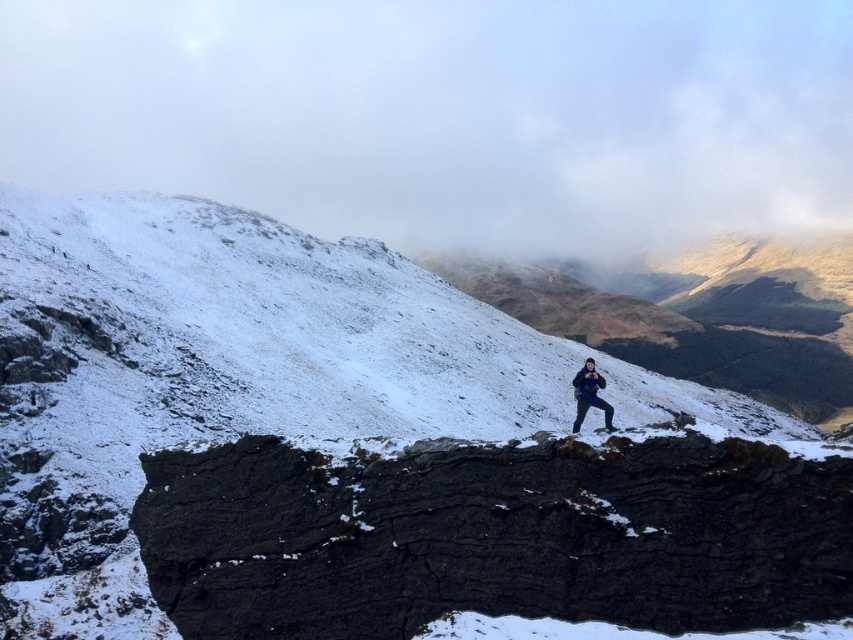
Is dark gray rock formation at center taller than dark gray rocky cliff at center?

Correct, dark gray rock formation at center is much taller as dark gray rocky cliff at center.

Which is more to the right, dark gray rock formation at center or dark gray rocky cliff at center?

dark gray rock formation at center is more to the right.

At what (x,y) coordinates should I click in order to perform the action: click on dark gray rock formation at center. Please return your answer as a coordinate pair (x, y). Looking at the image, I should click on (241, 376).

Who is positioned more to the right, dark gray rock formation at center or dark blue jacket at center?

dark blue jacket at center is more to the right.

From the picture: Between dark gray rock formation at center and dark blue jacket at center, which one appears on the left side from the viewer's perspective?

dark gray rock formation at center

Is point (413, 376) positioned before point (576, 381)?

No, it is behind (576, 381).

The height and width of the screenshot is (640, 853). In order to click on dark gray rock formation at center in this screenshot , I will do `click(241, 376)`.

From the picture: Can you confirm if dark gray rocky cliff at center is positioned below dark blue jacket at center?

Yes, dark gray rocky cliff at center is below dark blue jacket at center.

Which is behind, point (666, 508) or point (577, 412)?

The point (577, 412) is more distant.

What are the coordinates of `dark gray rocky cliff at center` in the screenshot? It's located at (494, 536).